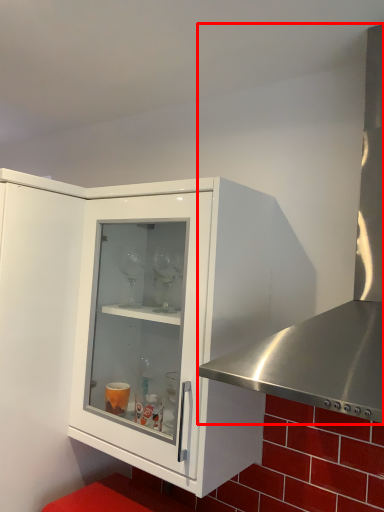
Question: From the image's perspective, what is the correct spatial relationship of kitchen appliance (annotated by the red box) in relation to cabinetry?

Choices:
 (A) above
 (B) below

Answer: (A)